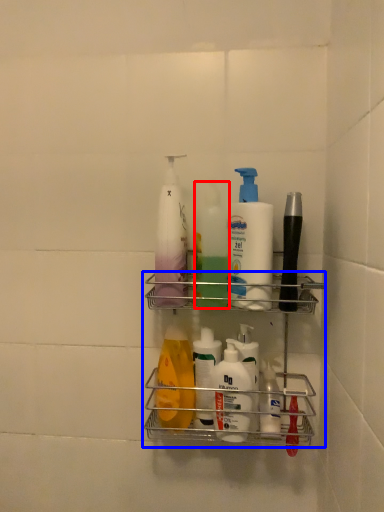
Question: Which object is closer to the camera taking this photo, cleaning product (highlighted by a red box) or shelf (highlighted by a blue box)?

Choices:
 (A) cleaning product
 (B) shelf

Answer: (B)